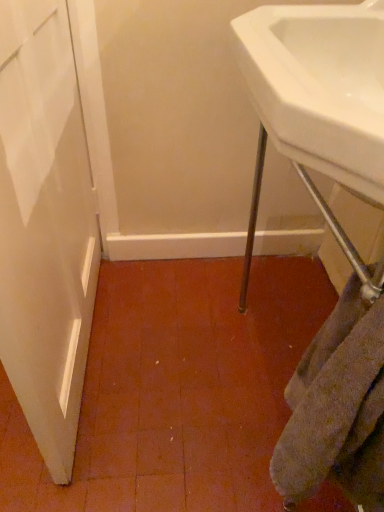
Describe the element at coordinates (320, 87) in the screenshot. I see `white glossy sink at upper right` at that location.

Locate an element on the screen. This screenshot has height=512, width=384. white glossy sink at upper right is located at coordinates pos(320,87).

What do you see at coordinates (337, 407) in the screenshot? Image resolution: width=384 pixels, height=512 pixels. I see `gray textured towel at lower right` at bounding box center [337, 407].

You are a GUI agent. You are given a task and a screenshot of the screen. Output one action in this format:
    pyautogui.click(x=<x>, y=<y>)
    Task: Click on the gray textured towel at lower right
    The image size is (384, 512).
    Given the screenshot: What is the action you would take?
    pyautogui.click(x=337, y=407)

Measure the distance between gray textured towel at lower right and camera.

The distance of gray textured towel at lower right from camera is 17.98 inches.

This screenshot has height=512, width=384. Find the location of `white glossy sink at upper right`. white glossy sink at upper right is located at coordinates (320, 87).

Which is more to the right, white glossy sink at upper right or gray textured towel at lower right?

white glossy sink at upper right is more to the right.

Considering the positions of objects white glossy sink at upper right and gray textured towel at lower right in the image provided, who is in front, white glossy sink at upper right or gray textured towel at lower right?

Positioned in front is white glossy sink at upper right.

Considering the positions of points (350, 129) and (303, 463), is point (350, 129) closer to camera compared to point (303, 463)?

Yes, it is in front of point (303, 463).

Looking at this image, from the image's perspective, who appears lower, white glossy sink at upper right or gray textured towel at lower right?

gray textured towel at lower right.

From a real-world perspective, is white glossy sink at upper right above or below gray textured towel at lower right?

Clearly, from a real-world perspective, white glossy sink at upper right is above gray textured towel at lower right.

Considering the relative sizes of white glossy sink at upper right and gray textured towel at lower right in the image provided, is white glossy sink at upper right wider than gray textured towel at lower right?

Yes, white glossy sink at upper right is wider than gray textured towel at lower right.

Is white glossy sink at upper right taller than gray textured towel at lower right?

In fact, white glossy sink at upper right may be shorter than gray textured towel at lower right.

Based on their sizes in the image, would you say white glossy sink at upper right is bigger or smaller than gray textured towel at lower right?

Considering their sizes, white glossy sink at upper right takes up more space than gray textured towel at lower right.

In the scene shown: Is white glossy sink at upper right surrounding gray textured towel at lower right?

Actually, gray textured towel at lower right is outside white glossy sink at upper right.

Can you see white glossy sink at upper right touching gray textured towel at lower right?

white glossy sink at upper right and gray textured towel at lower right are clearly separated.

Is white glossy sink at upper right looking in the opposite direction of gray textured towel at lower right?

No.

How different are the orientations of white glossy sink at upper right and gray textured towel at lower right in degrees?

The angular difference between white glossy sink at upper right and gray textured towel at lower right is 0.00311 degrees.

How far apart are white glossy sink at upper right and gray textured towel at lower right?

The distance of white glossy sink at upper right from gray textured towel at lower right is 13.67 inches.

Image resolution: width=384 pixels, height=512 pixels. I want to click on sink above the gray textured towel at lower right (from a real-world perspective), so click(320, 87).

Is gray textured towel at lower right to the right of white glossy sink at upper right from the viewer's perspective?

In fact, gray textured towel at lower right is to the left of white glossy sink at upper right.

Which is in front, gray textured towel at lower right or white glossy sink at upper right?

Positioned in front is white glossy sink at upper right.

Which is nearer, (298, 365) or (312, 20)?

Point (298, 365) is closer to the camera than point (312, 20).

From the image's perspective, does gray textured towel at lower right appear higher than white glossy sink at upper right?

Incorrect, from the image's perspective, gray textured towel at lower right is lower than white glossy sink at upper right.

From a real-world perspective, does gray textured towel at lower right sit lower than white glossy sink at upper right?

Yes, from a real-world perspective, gray textured towel at lower right is under white glossy sink at upper right.

Which object is wider, gray textured towel at lower right or white glossy sink at upper right?

white glossy sink at upper right.

Does gray textured towel at lower right have a lesser height compared to white glossy sink at upper right?

No, gray textured towel at lower right is not shorter than white glossy sink at upper right.

Consider the image. Who is smaller, gray textured towel at lower right or white glossy sink at upper right?

gray textured towel at lower right is smaller.

Would you say gray textured towel at lower right is outside white glossy sink at upper right?

gray textured towel at lower right is positioned outside white glossy sink at upper right.

Is gray textured towel at lower right positioned far away from white glossy sink at upper right?

No, there isn't a large distance between gray textured towel at lower right and white glossy sink at upper right.

Could you tell me if gray textured towel at lower right is facing white glossy sink at upper right?

No, gray textured towel at lower right is not turned towards white glossy sink at upper right.

How far apart are gray textured towel at lower right and white glossy sink at upper right?

gray textured towel at lower right is 13.67 inches away from white glossy sink at upper right.

Where is `sink positioned vertically above the gray textured towel at lower right (from a real-world perspective)`? The height and width of the screenshot is (512, 384). sink positioned vertically above the gray textured towel at lower right (from a real-world perspective) is located at coordinates (320, 87).

Identify the location of sink above the gray textured towel at lower right (from a real-world perspective). (320, 87).

You are a GUI agent. You are given a task and a screenshot of the screen. Output one action in this format:
    pyautogui.click(x=<x>, y=<y>)
    Task: Click on the sink in front of the gray textured towel at lower right
    The width and height of the screenshot is (384, 512).
    Given the screenshot: What is the action you would take?
    pyautogui.click(x=320, y=87)